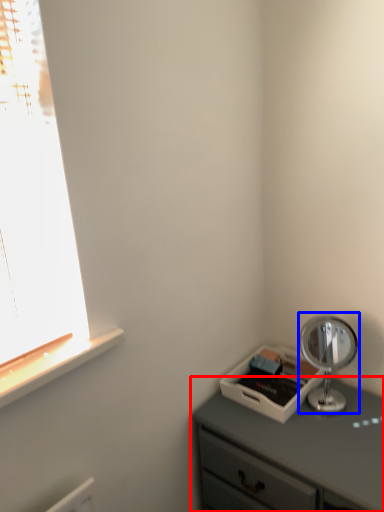
Question: Which object is further to the camera taking this photo, chest of drawers (highlighted by a red box) or table lamp (highlighted by a blue box)?

Choices:
 (A) chest of drawers
 (B) table lamp

Answer: (B)